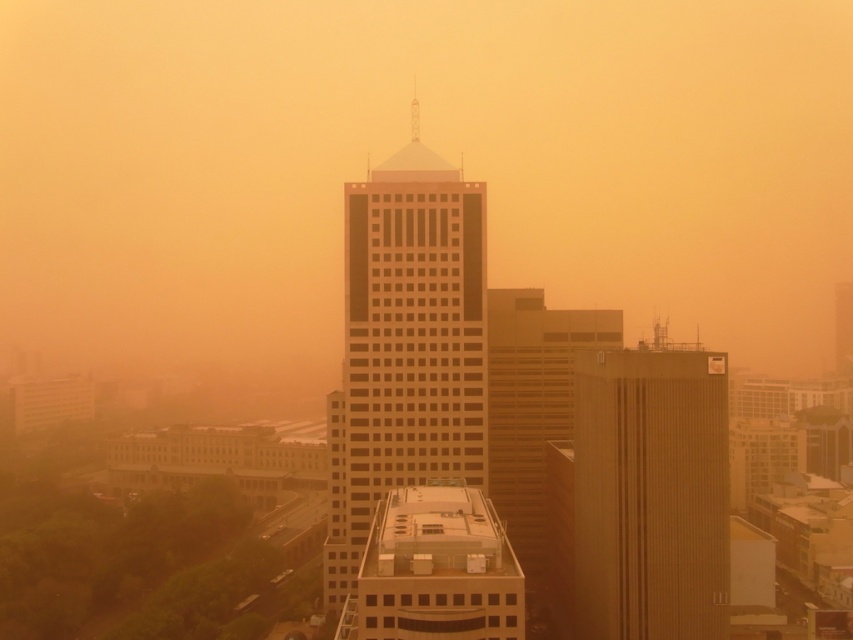
Does matte orange haze at center have a greater height compared to matte glass skyscraper at center?

Correct, matte orange haze at center is much taller as matte glass skyscraper at center.

Where is `matte orange haze at center`? This screenshot has width=853, height=640. matte orange haze at center is located at coordinates (434, 150).

The width and height of the screenshot is (853, 640). What do you see at coordinates (434, 150) in the screenshot?
I see `matte orange haze at center` at bounding box center [434, 150].

At what (x,y) coordinates should I click in order to perform the action: click on matte orange haze at center. Please return your answer as a coordinate pair (x, y). Looking at the image, I should click on (434, 150).

Which is more to the left, matte orange haze at center or brown textured building at center?

From the viewer's perspective, matte orange haze at center appears more on the left side.

Who is higher up, matte orange haze at center or brown textured building at center?

Positioned higher is matte orange haze at center.

Which is in front, point (747, 132) or point (720, 460)?

Point (720, 460) is more forward.

Where is `matte orange haze at center`? matte orange haze at center is located at coordinates (434, 150).

Is matte glass skyscraper at center closer to camera compared to brown textured building at center?

No, it is not.

Between matte glass skyscraper at center and brown textured building at center, which one is positioned higher?

Positioned higher is matte glass skyscraper at center.

What do you see at coordinates (405, 346) in the screenshot? The height and width of the screenshot is (640, 853). I see `matte glass skyscraper at center` at bounding box center [405, 346].

Locate an element on the screen. matte glass skyscraper at center is located at coordinates (405, 346).